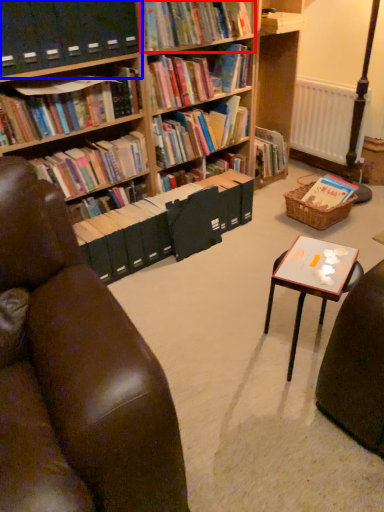
Question: Which point is closer to the camera, book (highlighted by a red box) or shelf (highlighted by a blue box)?

Choices:
 (A) book
 (B) shelf

Answer: (B)